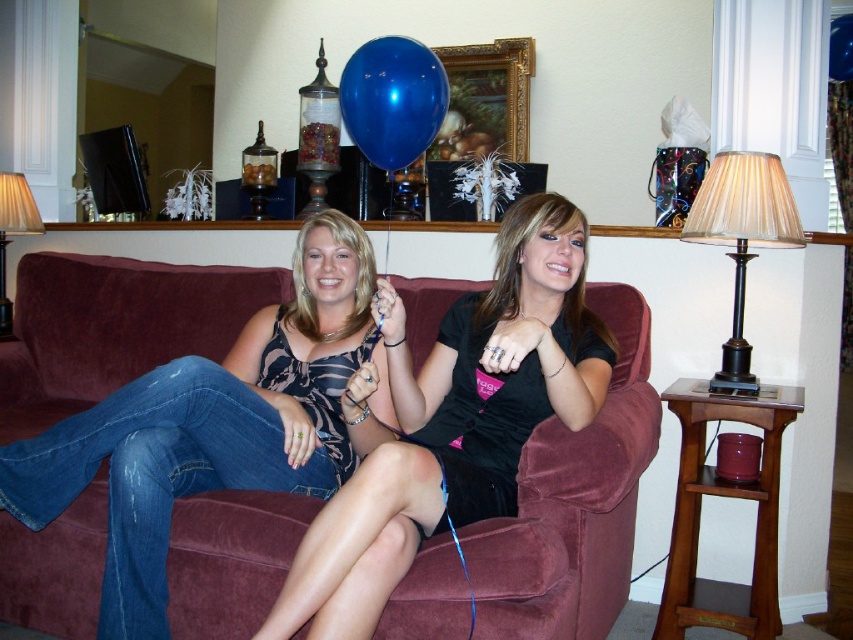
Question: Can you confirm if blue glossy balloon at center is bigger than matte beige lampshade at upper left?

Choices:
 (A) yes
 (B) no

Answer: (B)

Question: Which of the following is the farthest from the observer?

Choices:
 (A) (708, 221)
 (B) (10, 216)
 (C) (442, 211)
 (D) (415, 90)

Answer: (B)

Question: Does matte beige lampshade at right lie behind matte beige lampshade at upper left?

Choices:
 (A) no
 (B) yes

Answer: (A)

Question: Can you confirm if velvet maroon couch at center is smaller than blue glossy balloon at center?

Choices:
 (A) no
 (B) yes

Answer: (A)

Question: Which of the following is the closest to the observer?

Choices:
 (A) matte beige lampshade at upper left
 (B) matte beige lampshade at right
 (C) velvet maroon couch at center
 (D) gold-framed painting at upper center

Answer: (C)

Question: Among these objects, which one is farthest from the camera?

Choices:
 (A) matte beige lampshade at upper left
 (B) gold-framed painting at upper center

Answer: (B)